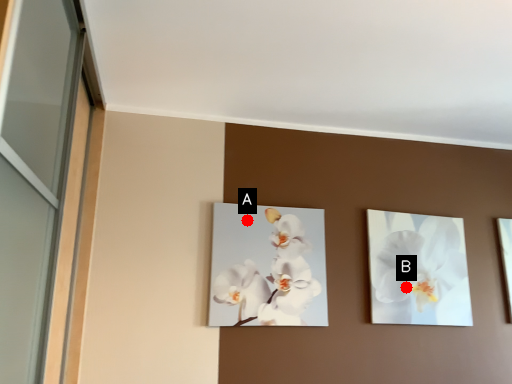
Question: Two points are circled on the image, labeled by A and B beside each circle. Among these points, which one is nearest to the camera?

Choices:
 (A) A is closer
 (B) B is closer

Answer: (A)